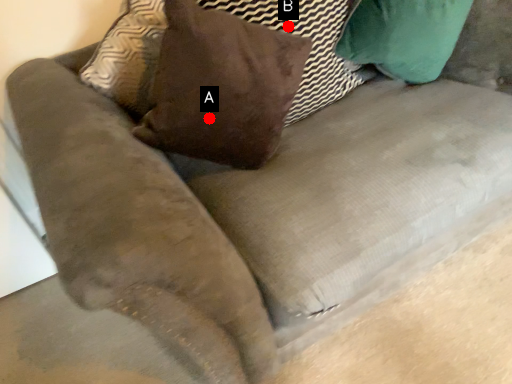
Question: Two points are circled on the image, labeled by A and B beside each circle. Which point is farther to the camera?

Choices:
 (A) A is further
 (B) B is further

Answer: (B)